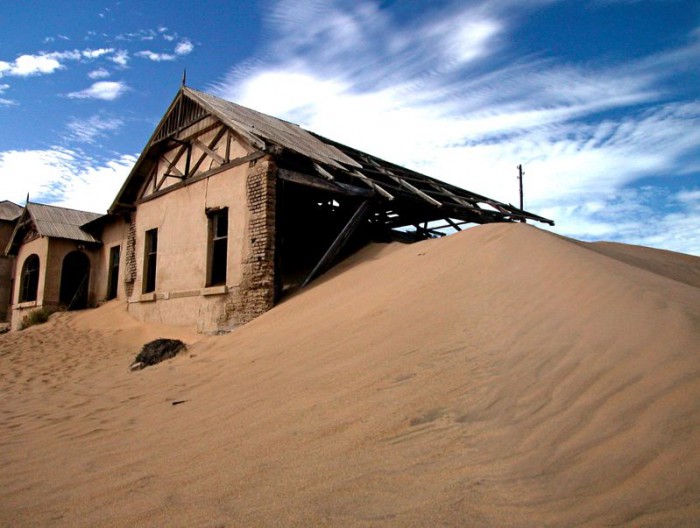
Find the location of a particular element. The height and width of the screenshot is (528, 700). rod is located at coordinates (518, 174).